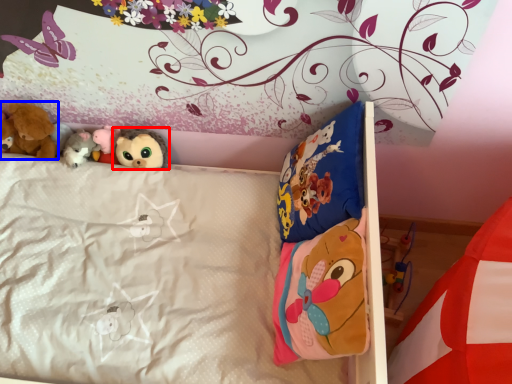
Question: Which object appears farthest to the camera in this image, toy (highlighted by a red box) or toy (highlighted by a blue box)?

Choices:
 (A) toy
 (B) toy

Answer: (A)